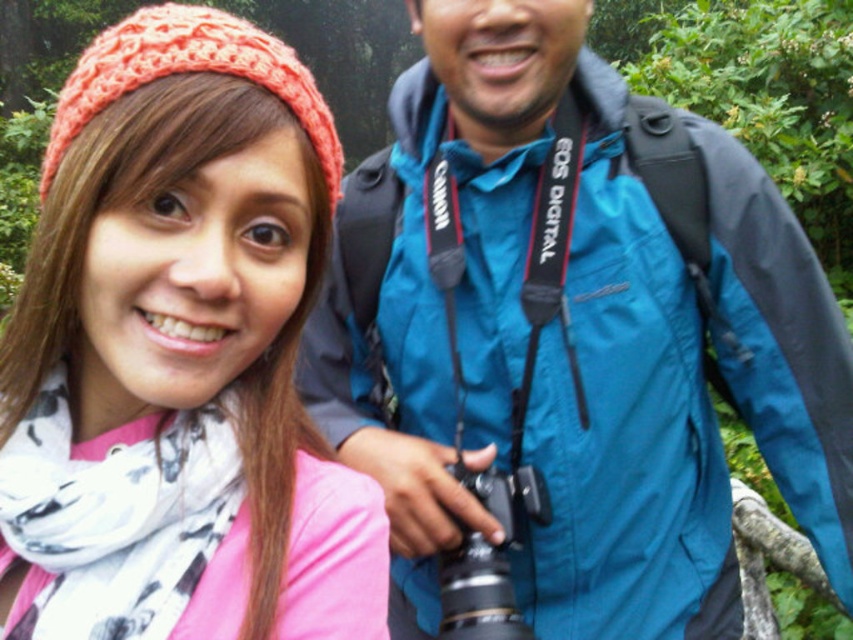
In the scene shown: You are taking a photo of the two people in the scene. The woman in the bright pink top and white scarf is at point (241,154) and the man with the camera is at point (498,612). Which person will appear larger in the photo?

The woman in the bright pink top and white scarf at point (241,154) will appear larger in the photo because she is closer to the camera than the man at point (498,612).

You are a photographer trying to capture a photo of the pink fabric scarf at center and the black plastic camera at center. Which object should you focus on first if you want to ensure both are in the frame without moving the camera?

Since the pink fabric scarf at center is much taller than the black plastic camera at center, you should focus on the pink fabric scarf at center first to ensure it fits within the frame, as its height requires more space.